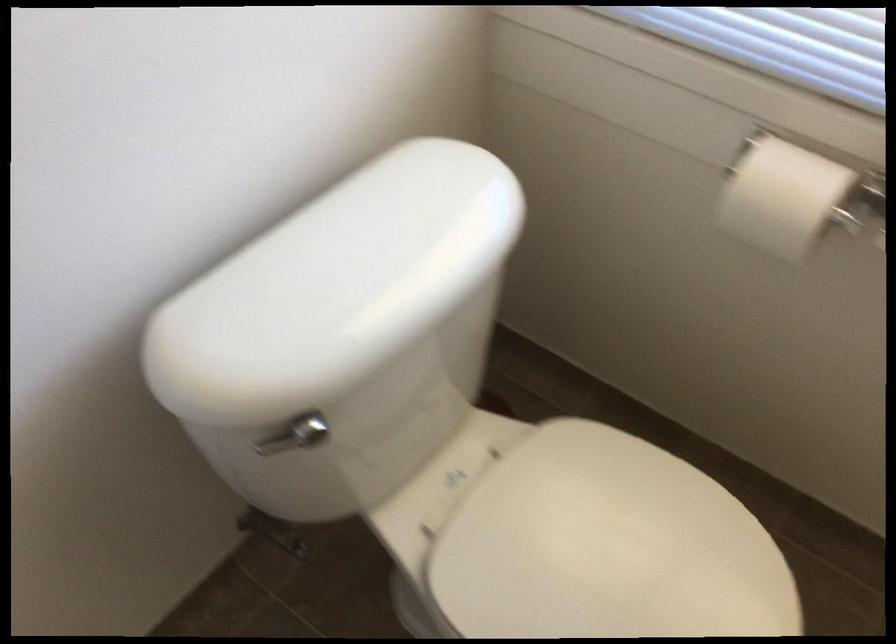
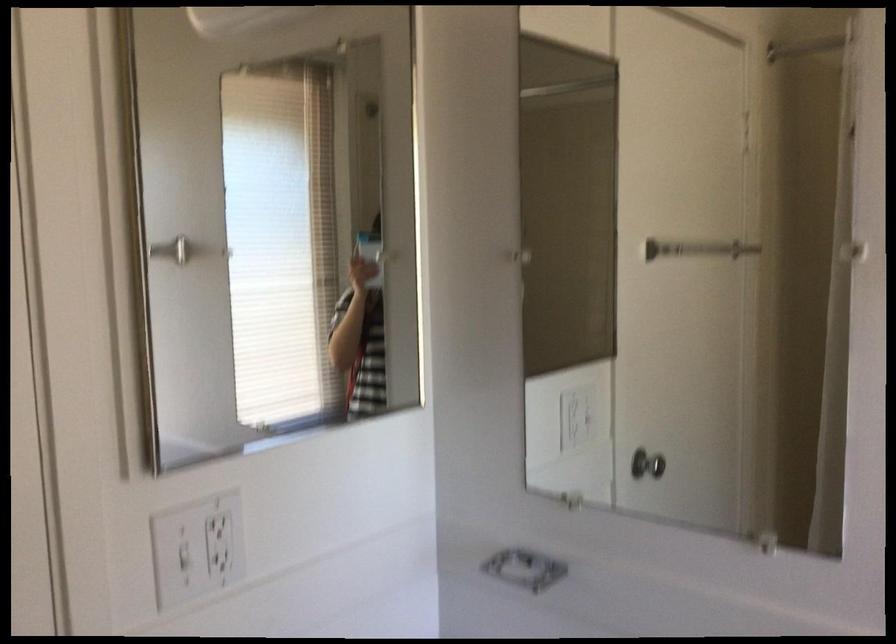
Question: Based on the continuous images, in which direction is the camera rotating? Reply with the corresponding letter.

Choices:
 (A) Left
 (B) Right
 (C) Up
 (D) Down

Answer: (A)